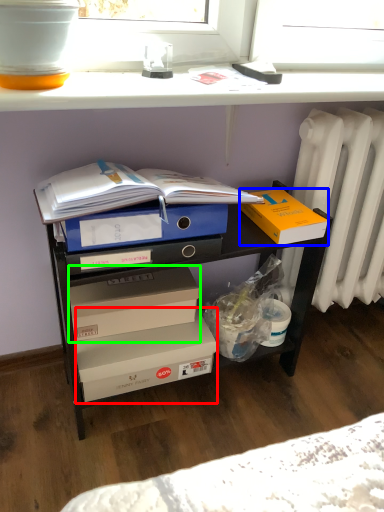
Question: Estimate the real-world distances between objects in this image. Which object is farther from box (highlighted by a red box), box (highlighted by a blue box) or box (highlighted by a green box)?

Choices:
 (A) box
 (B) box

Answer: (A)